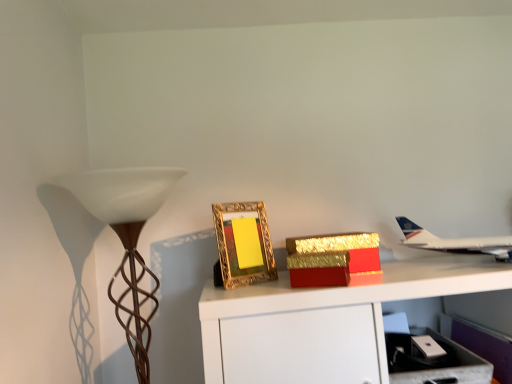
Question: From the image's perspective, is metallic silver drawer at lower right located beneath gold ornate frame at center?

Choices:
 (A) yes
 (B) no

Answer: (A)

Question: Is metallic silver drawer at lower right far away from gold ornate frame at center?

Choices:
 (A) yes
 (B) no

Answer: (B)

Question: Is metallic silver drawer at lower right not within gold ornate frame at center?

Choices:
 (A) yes
 (B) no

Answer: (A)

Question: Can you confirm if metallic silver drawer at lower right is bigger than gold ornate frame at center?

Choices:
 (A) yes
 (B) no

Answer: (A)

Question: From a real-world perspective, is metallic silver drawer at lower right over gold ornate frame at center?

Choices:
 (A) yes
 (B) no

Answer: (B)

Question: From a real-world perspective, relative to gold glittery box at center, is metallic silver drawer at lower right vertically above or below?

Choices:
 (A) above
 (B) below

Answer: (B)

Question: Considering the positions of metallic silver drawer at lower right and gold glittery box at center in the image, is metallic silver drawer at lower right taller or shorter than gold glittery box at center?

Choices:
 (A) short
 (B) tall

Answer: (B)

Question: From the image's perspective, is metallic silver drawer at lower right above or below gold glittery box at center?

Choices:
 (A) above
 (B) below

Answer: (B)

Question: Is metallic silver drawer at lower right in front of or behind gold glittery box at center in the image?

Choices:
 (A) front
 (B) behind

Answer: (A)

Question: Relative to brown textured lamp at left, is metallic silver drawer at lower right in front or behind?

Choices:
 (A) behind
 (B) front

Answer: (A)

Question: Based on their sizes in the image, would you say metallic silver drawer at lower right is bigger or smaller than brown textured lamp at left?

Choices:
 (A) big
 (B) small

Answer: (B)

Question: Is metallic silver drawer at lower right inside or outside of brown textured lamp at left?

Choices:
 (A) inside
 (B) outside

Answer: (B)

Question: From the image's perspective, is metallic silver drawer at lower right above or below brown textured lamp at left?

Choices:
 (A) above
 (B) below

Answer: (B)

Question: Is point (138, 317) closer or farther from the camera than point (245, 276)?

Choices:
 (A) farther
 (B) closer

Answer: (B)

Question: Is brown textured lamp at left taller or shorter than gold ornate frame at center?

Choices:
 (A) tall
 (B) short

Answer: (A)